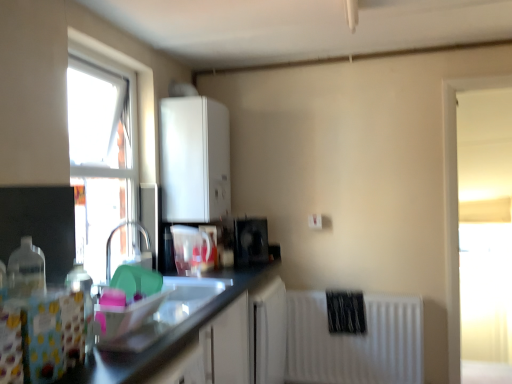
The width and height of the screenshot is (512, 384). Find the location of `blank space situated above black glossy speaker at center, marked as the first appliance in a right-to-left arrangement (from a real-world perspective)`. blank space situated above black glossy speaker at center, marked as the first appliance in a right-to-left arrangement (from a real-world perspective) is located at coordinates (247, 219).